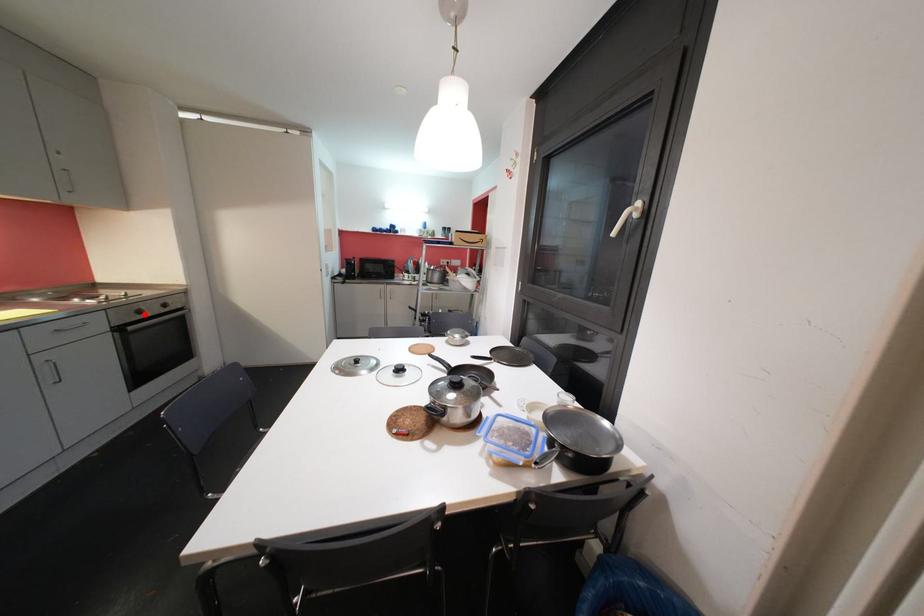
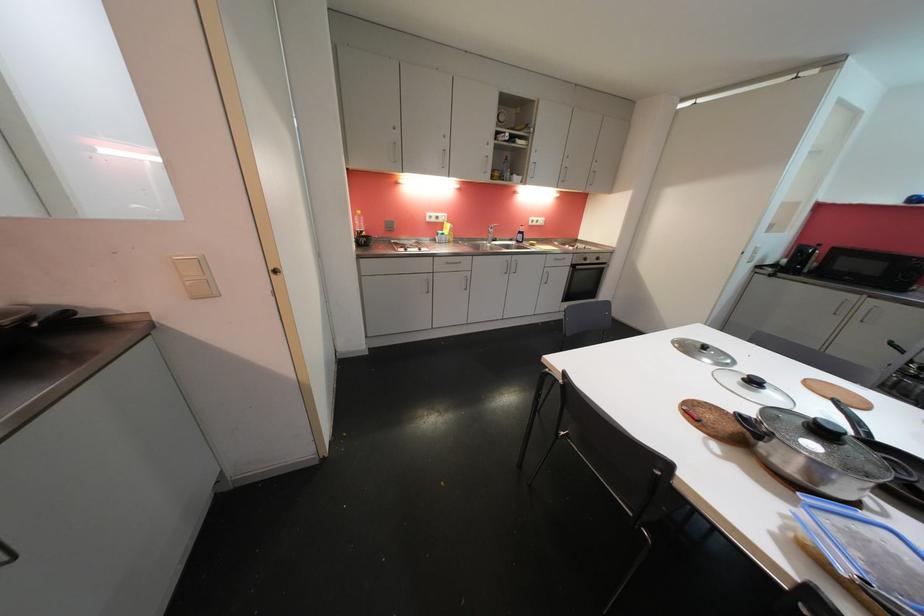
Question: I am providing you with two images of the same scene from different viewpoints. A red point is shown in image1. For the corresponding object point in image2, is it positioned nearer or farther from the camera?

Choices:
 (A) Nearer
 (B) Farther

Answer: (A)